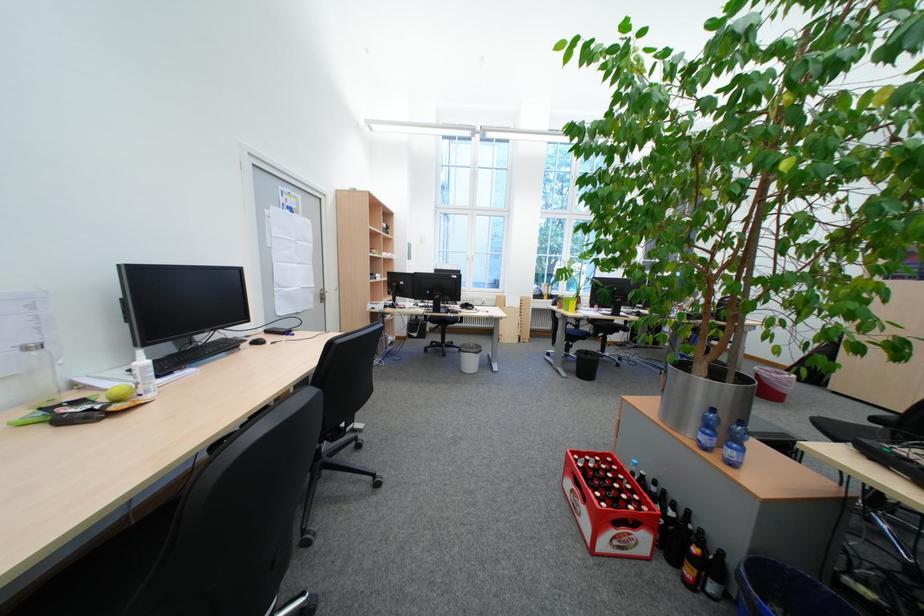
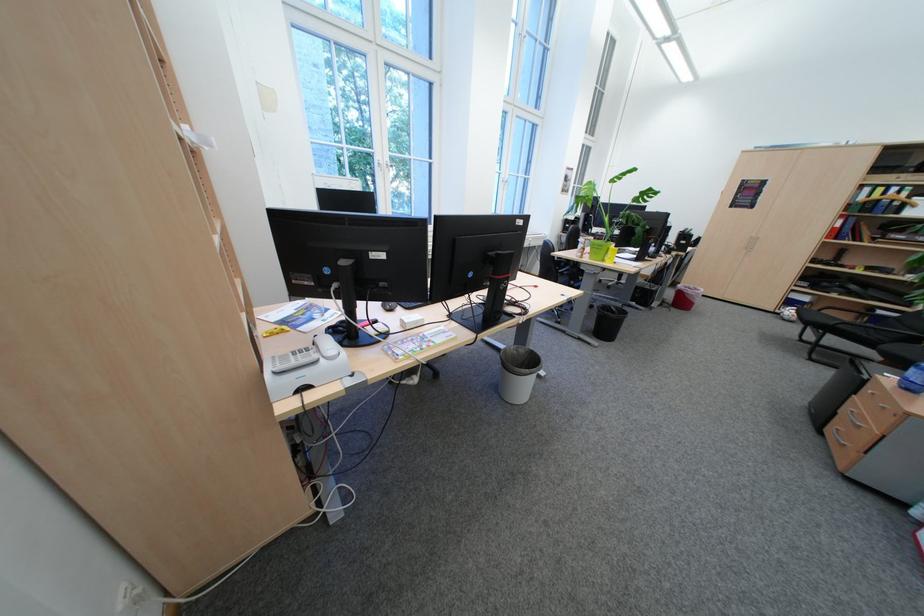
Question: I am providing you with two images of the same scene from different viewpoints. Please identify which objects are invisible in image2.

Choices:
 (A) white trash can
 (B) blue water bottle
 (C) silver table lamp
 (D) black computer mouse

Answer: (A)